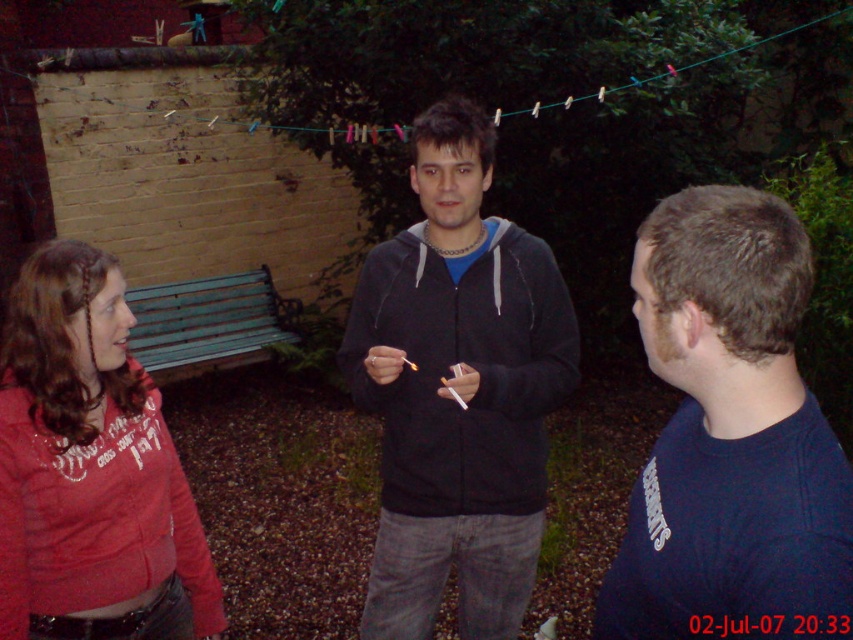
You are standing in the backyard scene and want to find the dark blue sweater at right. If you face the scene with the woman in red hoodie on the left and the man with the matchstick in the center, where should you look relative to the man with the matchstick?

The dark blue sweater at right is located to the right of the man with the matchstick in the center, as its 2D coordinates are at point (730, 436), which places it in the right area of the scene relative to the central figure.

Consider the image. You are organizing a clothing donation drive and need to categorize the dark blue sweater at right and the matte red hoodie at left based on their sizes. Which one should you place in the small size section?

The dark blue sweater at right has a smaller size compared to the matte red hoodie at left, so it should be placed in the small size section.